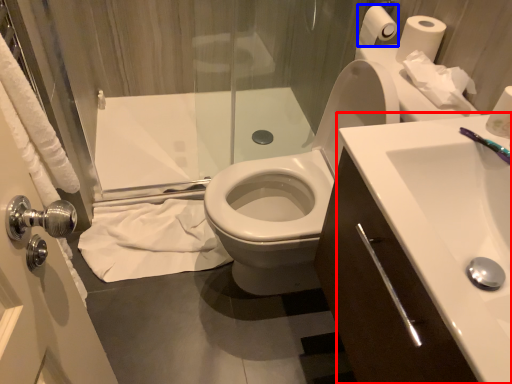
Question: Which point is closer to the camera, sink (highlighted by a red box) or toilet paper (highlighted by a blue box)?

Choices:
 (A) sink
 (B) toilet paper

Answer: (A)